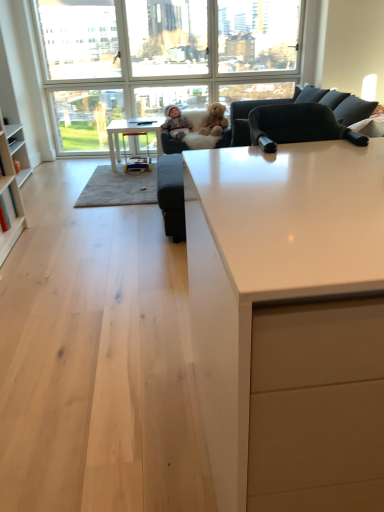
Question: Looking at their shapes, would you say white glossy table at center is wider or thinner than fluffy plush at center?

Choices:
 (A) wide
 (B) thin

Answer: (A)

Question: Is white glossy table at center inside the boundaries of fluffy plush at center, or outside?

Choices:
 (A) outside
 (B) inside

Answer: (A)

Question: Which object is positioned farthest from the matte gray baby at center?

Choices:
 (A) clear glass window at upper center
 (B) white glossy table at center
 (C) fluffy plush at center
 (D) white glossy countertop at center
 (E) wooden stool at center

Answer: (D)

Question: Which object is positioned farthest from the white glossy table at center?

Choices:
 (A) matte gray baby at center
 (B) fluffy beige teddy bear at center
 (C) wooden stool at center
 (D) clear glass window at upper center
 (E) fluffy plush at center

Answer: (D)